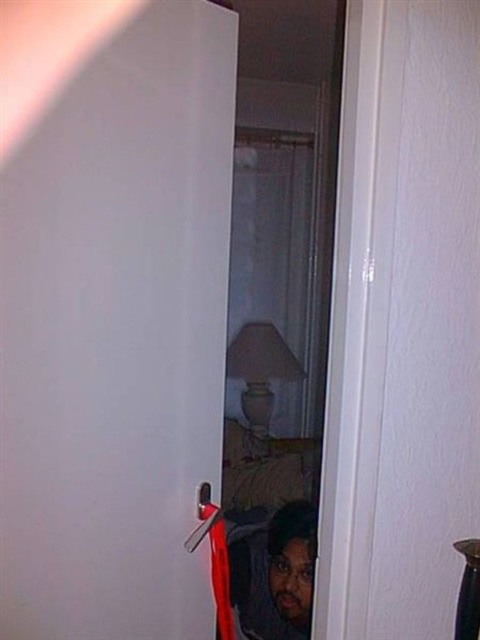
Question: In this image, where is white glossy door at center located relative to dark brown hair at lower center?

Choices:
 (A) right
 (B) left

Answer: (B)

Question: Which object is farther from the camera taking this photo?

Choices:
 (A) white glossy door at center
 (B) dark brown hair at lower center

Answer: (B)

Question: Can you confirm if white glossy door at center is positioned to the left of dark brown hair at lower center?

Choices:
 (A) no
 (B) yes

Answer: (B)

Question: Which object appears closest to the camera in this image?

Choices:
 (A) white glossy door at center
 (B) dark brown hair at lower center

Answer: (A)

Question: Which object appears farthest from the camera in this image?

Choices:
 (A) white glossy door at center
 (B) dark brown hair at lower center

Answer: (B)

Question: Is white glossy door at center to the right of dark brown hair at lower center from the viewer's perspective?

Choices:
 (A) yes
 (B) no

Answer: (B)